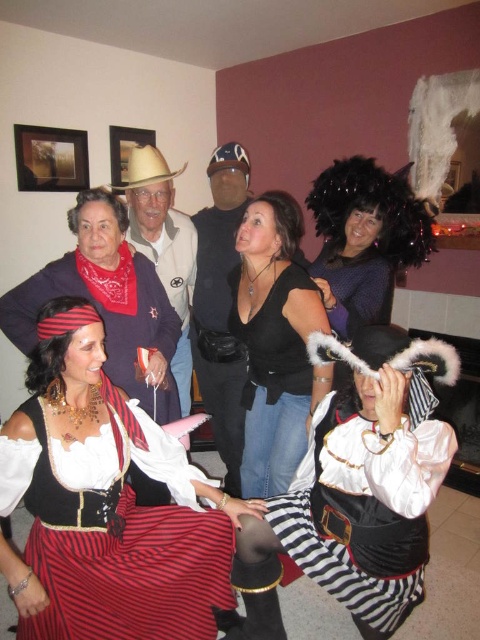
Measure the distance between point (304, 321) and camera.

Point (304, 321) and camera are 1.99 meters apart.

Does black matte shirt at center have a lesser width compared to light brown felt cowboy hat at center?

Incorrect, black matte shirt at center's width is not less than light brown felt cowboy hat at center's.

Is point (276, 241) in front of point (123, 180)?

Yes, it is in front of point (123, 180).

Where is `black matte shirt at center`? black matte shirt at center is located at coordinates (276, 342).

Who is more forward, (402,202) or (160,280)?

Point (402,202)

The height and width of the screenshot is (640, 480). What do you see at coordinates (364, 237) in the screenshot?
I see `purple fuzzy hat at upper center` at bounding box center [364, 237].

Locate an element on the screen. purple fuzzy hat at upper center is located at coordinates (364, 237).

Can you confirm if matte black pirate costume at center is wider than brown leather cowboy hat at upper center?

Yes, matte black pirate costume at center is wider than brown leather cowboy hat at upper center.

Does matte black pirate costume at center have a lesser width compared to brown leather cowboy hat at upper center?

In fact, matte black pirate costume at center might be wider than brown leather cowboy hat at upper center.

Locate an element on the screen. This screenshot has width=480, height=640. matte black pirate costume at center is located at coordinates click(x=107, y=301).

You are a GUI agent. You are given a task and a screenshot of the screen. Output one action in this format:
    pyautogui.click(x=<x>, y=<y>)
    Task: Click on the matte black pirate costume at center
    
    Given the screenshot: What is the action you would take?
    pyautogui.click(x=107, y=301)